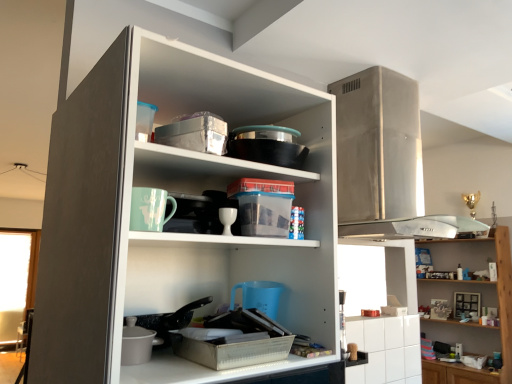
Locate an element on the screen. Image resolution: width=512 pixels, height=384 pixels. wooden shelves at upper right is located at coordinates (480, 306).

Describe the element at coordinates (170, 233) in the screenshot. I see `white matte cupboard at center` at that location.

What is the approximate height of white glossy cabinet at lower right?

It is 13.70 inches.

Where is `wooden shelves at upper right`? wooden shelves at upper right is located at coordinates (480, 306).

Is white glossy cabinet at lower right at the right side of white matte cupboard at center?

Indeed, white glossy cabinet at lower right is positioned on the right side of white matte cupboard at center.

Considering the positions of objects white glossy cabinet at lower right and white matte cupboard at center in the image provided, who is behind, white glossy cabinet at lower right or white matte cupboard at center?

white glossy cabinet at lower right.

Does point (418, 317) appear closer or farther from the camera than point (71, 272)?

Clearly, point (418, 317) is more distant from the camera than point (71, 272).

From the image's perspective, is white glossy cabinet at lower right located above or below white matte cupboard at center?

Clearly, from the image's perspective, white glossy cabinet at lower right is below white matte cupboard at center.

Consider the image. Can you confirm if white glossy cup at center is positioned to the left of white glossy cabinet at lower right?

Yes, white glossy cup at center is to the left of white glossy cabinet at lower right.

Can we say white glossy cup at center lies outside white glossy cabinet at lower right?

white glossy cup at center lies outside white glossy cabinet at lower right's area.

Which of these two, white glossy cup at center or white glossy cabinet at lower right, is wider?

With larger width is white glossy cup at center.

Does white glossy cup at center have a lesser height compared to white glossy cabinet at lower right?

Indeed, white glossy cup at center has a lesser height compared to white glossy cabinet at lower right.

Is wooden shelves at upper right to the left of white matte cupboard at center from the viewer's perspective?

In fact, wooden shelves at upper right is to the right of white matte cupboard at center.

Is wooden shelves at upper right located outside white matte cupboard at center?

Yes, wooden shelves at upper right is not within white matte cupboard at center.

Which is behind, wooden shelves at upper right or white matte cupboard at center?

wooden shelves at upper right is further from the camera.

Can you confirm if white glossy cabinet at lower right is positioned to the left of white glossy cup at center?

No, white glossy cabinet at lower right is not to the left of white glossy cup at center.

Which is less distant, (403, 329) or (226, 210)?

Point (403, 329) is farther from the camera than point (226, 210).

Is white glossy cabinet at lower right positioned behind white glossy cup at center?

Yes, the depth of white glossy cabinet at lower right is greater than that of white glossy cup at center.

Which point is more distant from viewer, (125, 136) or (347, 340)?

Point (347, 340)

Considering the sizes of white matte cupboard at center and white glossy cabinet at lower right in the image, is white matte cupboard at center wider or thinner than white glossy cabinet at lower right?

Clearly, white matte cupboard at center has more width compared to white glossy cabinet at lower right.

Considering the positions of objects white matte cupboard at center and white glossy cabinet at lower right in the image provided, who is more to the left, white matte cupboard at center or white glossy cabinet at lower right?

white matte cupboard at center is more to the left.

Between white matte cupboard at center and white glossy cabinet at lower right, which one has less height?

white glossy cabinet at lower right.

Is wooden shelves at upper right not close to white glossy cabinet at lower right?

Indeed, wooden shelves at upper right is not near white glossy cabinet at lower right.

Is point (505, 375) closer to camera compared to point (383, 340)?

No, it is not.

Considering the relative positions of wooden shelves at upper right and white glossy cabinet at lower right in the image provided, is wooden shelves at upper right in front of white glossy cabinet at lower right?

No, the depth of wooden shelves at upper right is greater than that of white glossy cabinet at lower right.

Can wooden shelves at upper right be found inside white glossy cabinet at lower right?

Actually, wooden shelves at upper right is outside white glossy cabinet at lower right.

Considering the sizes of objects white glossy cabinet at lower right and wooden shelves at upper right in the image provided, who is smaller, white glossy cabinet at lower right or wooden shelves at upper right?

Smaller between the two is white glossy cabinet at lower right.

Considering the positions of objects white glossy cabinet at lower right and wooden shelves at upper right in the image provided, who is more to the left, white glossy cabinet at lower right or wooden shelves at upper right?

white glossy cabinet at lower right is more to the left.

Find the location of a particular element. The image size is (512, 384). cupboard that is above the white glossy cabinet at lower right (from the image's perspective) is located at coordinates (170, 233).

You are a GUI agent. You are given a task and a screenshot of the screen. Output one action in this format:
    pyautogui.click(x=<x>, y=<y>)
    Task: Click on the cabinetry behind the white glossy cup at center
    This screenshot has width=512, height=384.
    Given the screenshot: What is the action you would take?
    pyautogui.click(x=386, y=349)

Based on their spatial positions, is white glossy cabinet at lower right or wooden shelves at upper right closer to white glossy cup at center?

white glossy cabinet at lower right is closer to white glossy cup at center.

Estimate the real-world distances between objects in this image. Which object is further from white glossy cup at center, wooden shelves at upper right or white matte cupboard at center?

wooden shelves at upper right.

From the image, which object appears to be farther from white glossy cabinet at lower right, white glossy cup at center or wooden shelves at upper right?

wooden shelves at upper right is further to white glossy cabinet at lower right.

From the image, which object appears to be nearer to white glossy cup at center, white matte cupboard at center or white glossy cabinet at lower right?

Among the two, white matte cupboard at center is located nearer to white glossy cup at center.

From the image, which object appears to be nearer to wooden shelves at upper right, white matte cupboard at center or white glossy cup at center?

white matte cupboard at center is closer to wooden shelves at upper right.

When comparing their distances from wooden shelves at upper right, does white glossy cabinet at lower right or white glossy cup at center seem further?

white glossy cup at center lies further to wooden shelves at upper right than the other object.

In the scene shown: Considering their positions, is wooden shelves at upper right positioned closer to white glossy cabinet at lower right than white matte cupboard at center?

white matte cupboard at center lies closer to white glossy cabinet at lower right than the other object.

From the image, which object appears to be nearer to white matte cupboard at center, white glossy cabinet at lower right or wooden shelves at upper right?

white glossy cabinet at lower right.

Image resolution: width=512 pixels, height=384 pixels. Find the location of `cabinetry positioned between white glossy cup at center and wooden shelves at upper right from near to far`. cabinetry positioned between white glossy cup at center and wooden shelves at upper right from near to far is located at coordinates (386, 349).

Find the location of a particular element. This screenshot has width=512, height=384. tableware located between white matte cupboard at center and white glossy cabinet at lower right in the depth direction is located at coordinates (227, 219).

This screenshot has height=384, width=512. What are the coordinates of `cabinetry between white matte cupboard at center and wooden shelves at upper right along the z-axis` in the screenshot? It's located at (386, 349).

Locate an element on the screen. The image size is (512, 384). tableware between white matte cupboard at center and wooden shelves at upper right in the front-back direction is located at coordinates (227, 219).